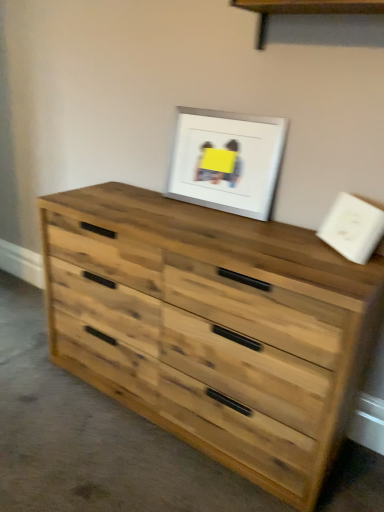
Question: Is white matte picture frame at upper center taller than natural wood chest of drawers at center?

Choices:
 (A) yes
 (B) no

Answer: (B)

Question: From a real-world perspective, is white matte picture frame at upper center located beneath natural wood chest of drawers at center?

Choices:
 (A) yes
 (B) no

Answer: (B)

Question: Is white matte picture frame at upper center in contact with natural wood chest of drawers at center?

Choices:
 (A) no
 (B) yes

Answer: (A)

Question: Is white matte picture frame at upper center outside of natural wood chest of drawers at center?

Choices:
 (A) yes
 (B) no

Answer: (A)

Question: From a real-world perspective, is white matte picture frame at upper center on natural wood chest of drawers at center?

Choices:
 (A) yes
 (B) no

Answer: (A)

Question: Considering the positions of natural wood chest of drawers at center and wooden shelf at upper center in the image, is natural wood chest of drawers at center wider or thinner than wooden shelf at upper center?

Choices:
 (A) wide
 (B) thin

Answer: (A)

Question: Relative to wooden shelf at upper center, is natural wood chest of drawers at center in front or behind?

Choices:
 (A) front
 (B) behind

Answer: (A)

Question: From a real-world perspective, is natural wood chest of drawers at center physically located above or below wooden shelf at upper center?

Choices:
 (A) below
 (B) above

Answer: (A)

Question: Is natural wood chest of drawers at center inside or outside of wooden shelf at upper center?

Choices:
 (A) inside
 (B) outside

Answer: (B)

Question: Considering the relative positions of wooden shelf at upper center and white matte picture frame at upper center in the image provided, is wooden shelf at upper center to the left or to the right of white matte picture frame at upper center?

Choices:
 (A) right
 (B) left

Answer: (A)

Question: Is wooden shelf at upper center wider or thinner than white matte picture frame at upper center?

Choices:
 (A) thin
 (B) wide

Answer: (B)

Question: Looking at the image, does wooden shelf at upper center seem bigger or smaller compared to white matte picture frame at upper center?

Choices:
 (A) big
 (B) small

Answer: (A)

Question: Is point (258, 4) positioned closer to the camera than point (254, 141)?

Choices:
 (A) farther
 (B) closer

Answer: (B)

Question: From the image's perspective, is wooden shelf at upper center located above or below natural wood chest of drawers at center?

Choices:
 (A) below
 (B) above

Answer: (B)

Question: In terms of width, does wooden shelf at upper center look wider or thinner when compared to natural wood chest of drawers at center?

Choices:
 (A) thin
 (B) wide

Answer: (A)